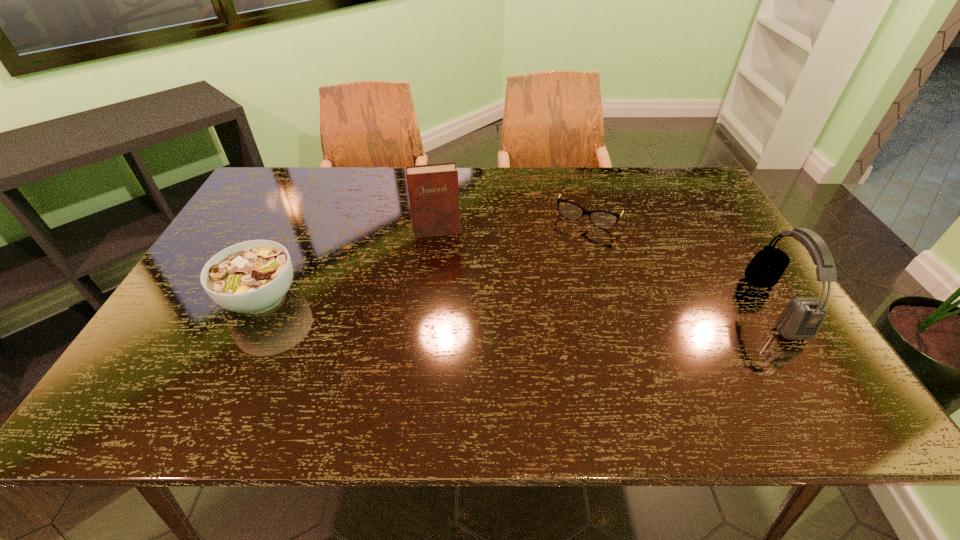
Locate an element on the screen. Image resolution: width=960 pixels, height=540 pixels. free space located on the front-facing side of the shortest object is located at coordinates pos(545,294).

The image size is (960, 540). What are the coordinates of `blank area located on the front-facing side of the shortest object` in the screenshot? It's located at (554, 279).

At what (x,y) coordinates should I click in order to perform the action: click on vacant space located 0.200m on the front-facing side of the shortest object. Please return your answer as a coordinate pair (x, y). Looking at the image, I should click on (558, 272).

I want to click on object that is at the far edge, so click(x=602, y=219).

The width and height of the screenshot is (960, 540). I want to click on object that is at the near edge, so click(801, 319).

Identify the location of object that is at the left edge. (252, 277).

This screenshot has width=960, height=540. In order to click on object located at the right edge in this screenshot , I will do `click(801, 319)`.

At what (x,y) coordinates should I click in order to perform the action: click on object situated at the near right corner. Please return your answer as a coordinate pair (x, y). Looking at the image, I should click on (801, 319).

The height and width of the screenshot is (540, 960). I want to click on vacant space at the far edge of the desktop, so click(553, 173).

Find the location of a particular element. This screenshot has width=960, height=540. free location at the near edge is located at coordinates (400, 360).